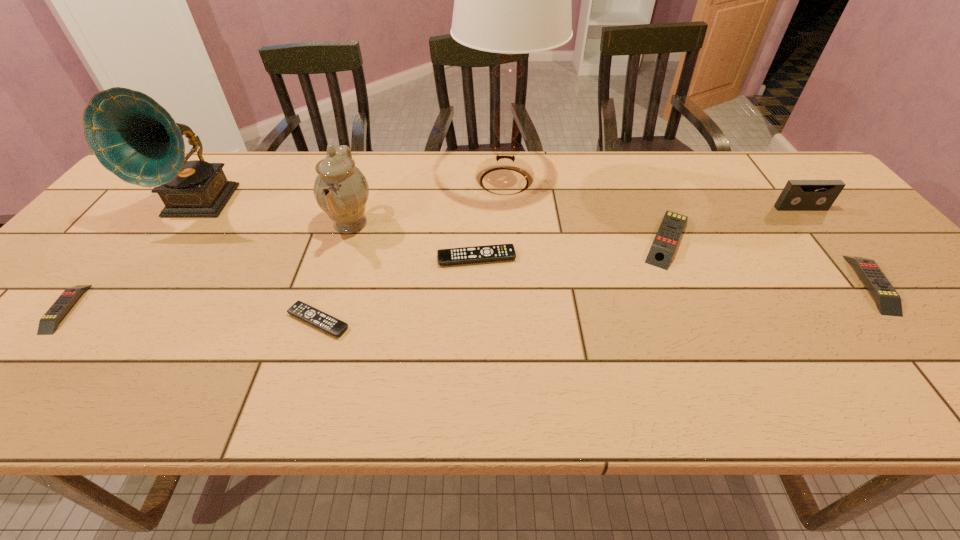
Where is `vacant space located 0.330m on the front of the tallest remote control`? vacant space located 0.330m on the front of the tallest remote control is located at coordinates (737, 394).

Image resolution: width=960 pixels, height=540 pixels. Identify the location of free point located on the front of the fourth shortest remote control. (917, 339).

At what (x,y) coordinates should I click in order to perform the action: click on vacant area situated on the back of the leftmost yellow remote control. Please return your answer as a coordinate pair (x, y). Looking at the image, I should click on (102, 267).

Image resolution: width=960 pixels, height=540 pixels. I want to click on free space located 0.380m on the right of the bigger black remote control, so click(x=669, y=258).

You are a GUI agent. You are given a task and a screenshot of the screen. Output one action in this format:
    pyautogui.click(x=<x>, y=<y>)
    Task: Click on the vacant area situated 0.230m on the back of the left black remote control
    
    Given the screenshot: What is the action you would take?
    pyautogui.click(x=346, y=237)

Locate an element on the screen. The image size is (960, 540). table lamp that is at the far edge is located at coordinates (510, 0).

Identify the location of phonograph_record present at the far edge. (135, 138).

At what (x,y) coordinates should I click in order to perform the action: click on phonograph_record that is positioned at the left edge. Please return your answer as a coordinate pair (x, y). This screenshot has height=540, width=960. Looking at the image, I should click on (135, 138).

Identify the location of remote control at the left edge. The width and height of the screenshot is (960, 540). (48, 324).

I want to click on videotape situated at the right edge, so 798,195.